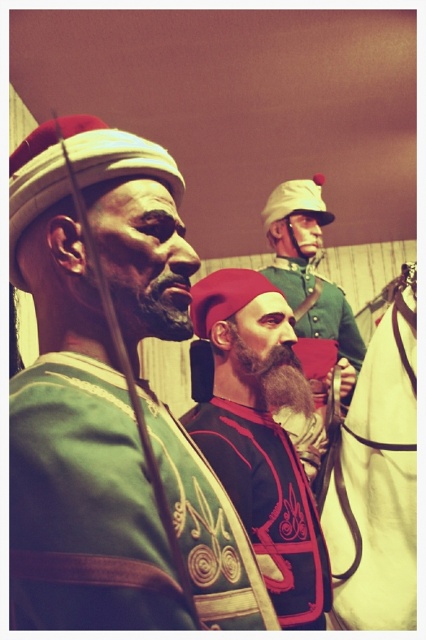
Question: Which point appears closest to the camera in this image?

Choices:
 (A) (414, 340)
 (B) (305, 384)
 (C) (118, 296)

Answer: (C)

Question: Can you confirm if white matte horse at right is positioned above dark brown thick beard at center?

Choices:
 (A) yes
 (B) no

Answer: (B)

Question: Which object is farther from the camera taking this photo?

Choices:
 (A) velvet red beret at center
 (B) dark brown thick beard at center

Answer: (B)

Question: Does dark brown matte beard at center appear over dark brown thick beard at center?

Choices:
 (A) yes
 (B) no

Answer: (A)

Question: Estimate the real-world distances between objects in this image. Which object is farther from the dark brown thick beard at center?

Choices:
 (A) velvet red beret at center
 (B) dark brown matte beard at center
 (C) white matte horse at right
 (D) green matte uniform at center

Answer: (C)

Question: Does dark brown matte beard at center have a smaller size compared to dark brown thick beard at center?

Choices:
 (A) no
 (B) yes

Answer: (B)